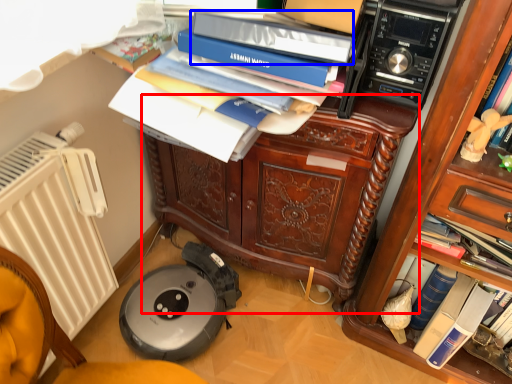
Question: Among these objects, which one is nearest to the camera, cabinetry (highlighted by a red box) or bin (highlighted by a blue box)?

Choices:
 (A) cabinetry
 (B) bin

Answer: (B)